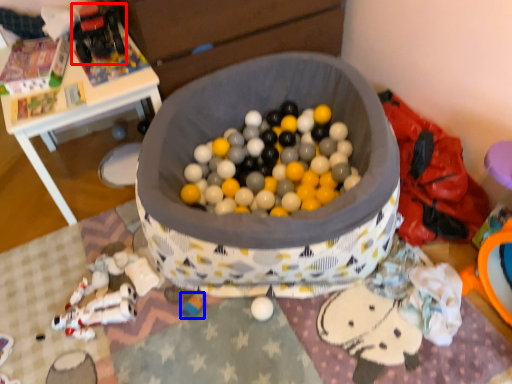
Question: Which point is closer to the camera, toy (highlighted by a red box) or toy (highlighted by a blue box)?

Choices:
 (A) toy
 (B) toy

Answer: (B)